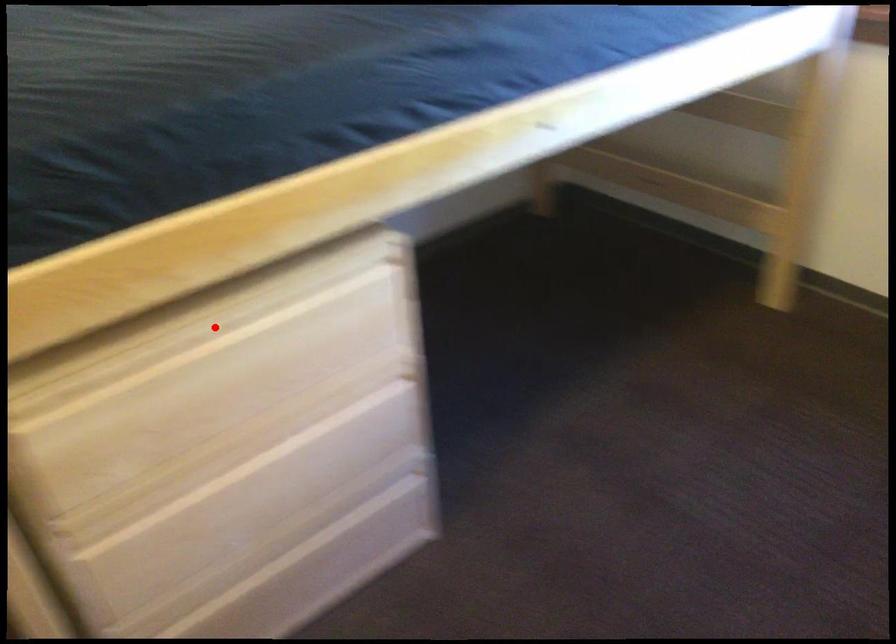
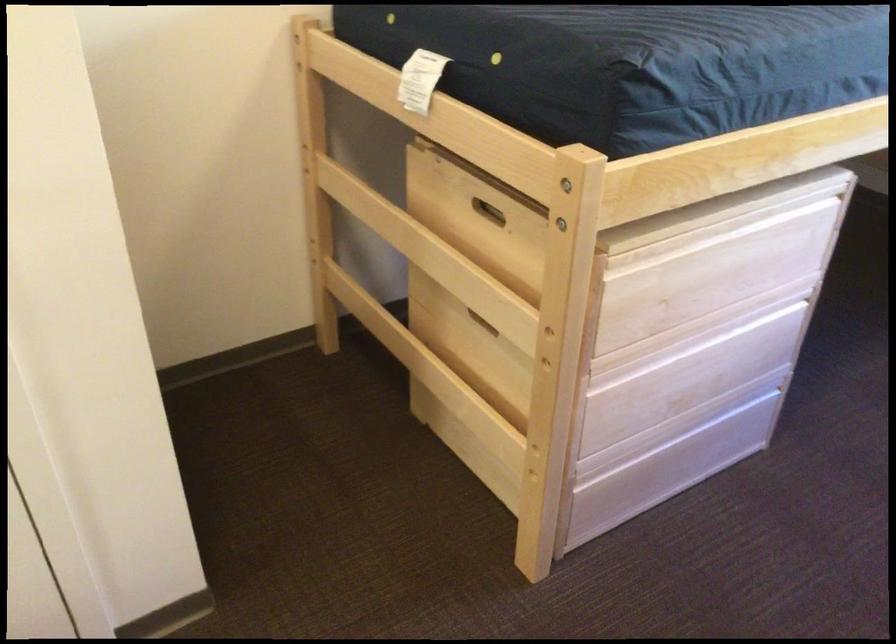
The point at the highlighted location is marked in the first image. Where is the corresponding point in the second image?

(720, 230)